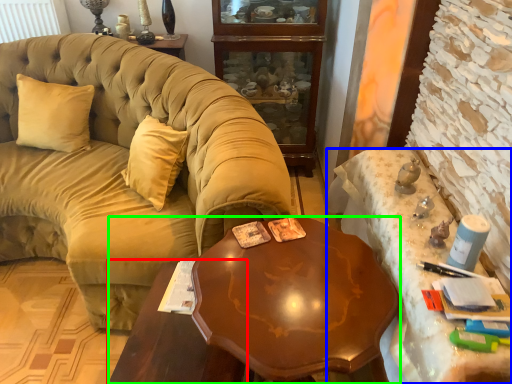
Question: Which object is positioned farthest from table (highlighted by a red box)? Select from desk (highlighted by a blue box) and desk (highlighted by a green box).

Choices:
 (A) desk
 (B) desk

Answer: (A)